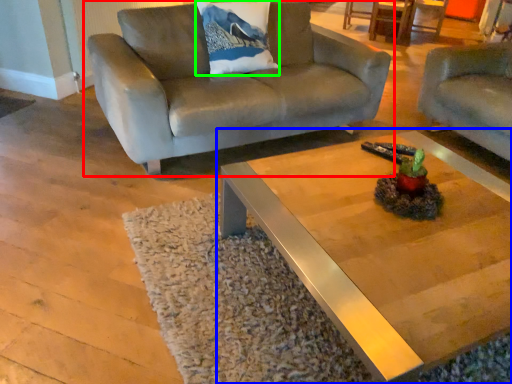
Question: Which object is positioned closest to studio couch (highlighted by a red box)? Select from coffee table (highlighted by a blue box) and pillow (highlighted by a green box).

Choices:
 (A) coffee table
 (B) pillow

Answer: (B)